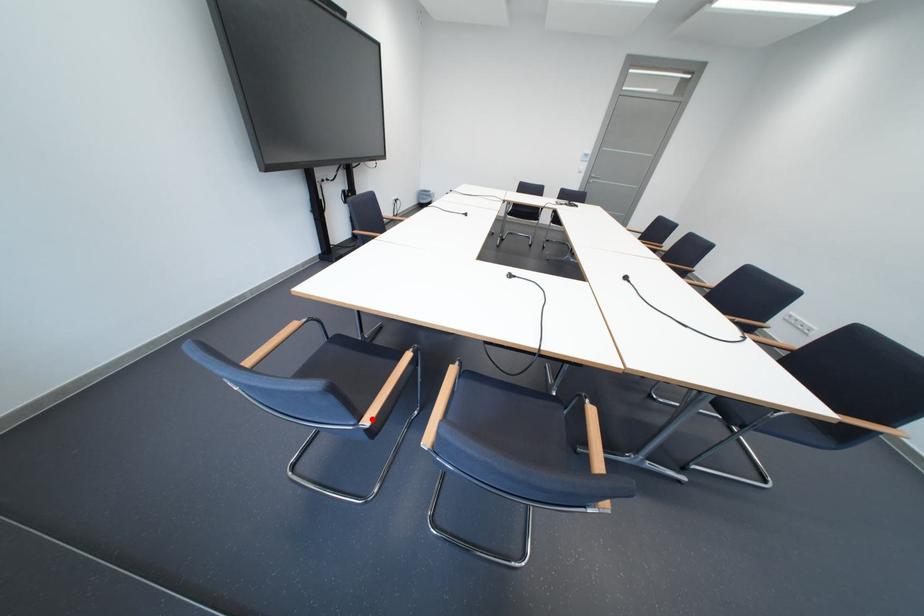
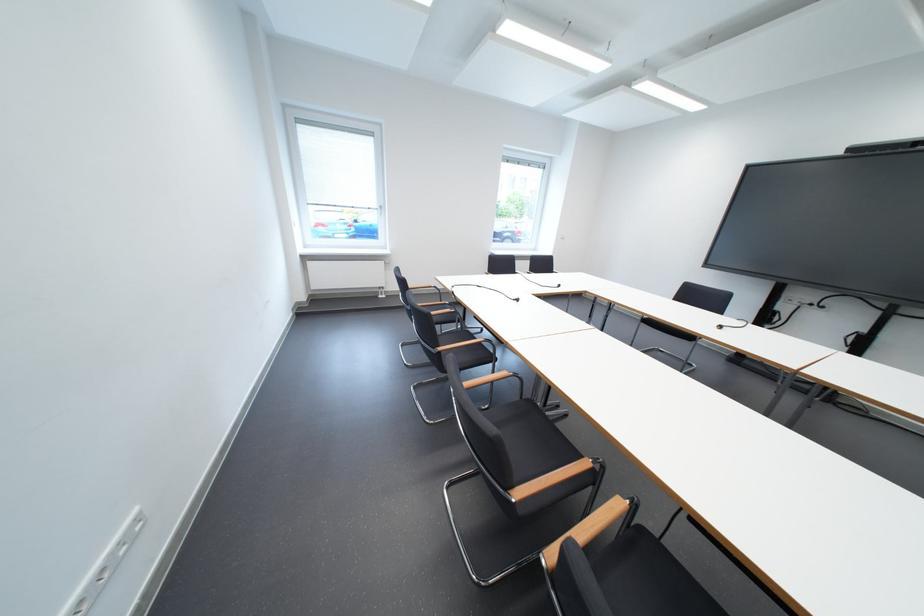
Question: I am providing you with two images of the same scene from different viewpoints. A red point is marked on the first image. Can you still see the location of the red point in image 2?

Choices:
 (A) Yes
 (B) No

Answer: (B)